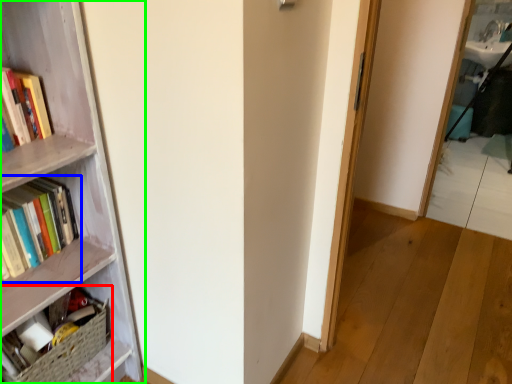
Question: Estimate the real-world distances between objects in this image. Which object is closer to book (highlighted by a red box), book (highlighted by a blue box) or bookcase (highlighted by a green box)?

Choices:
 (A) book
 (B) bookcase

Answer: (B)